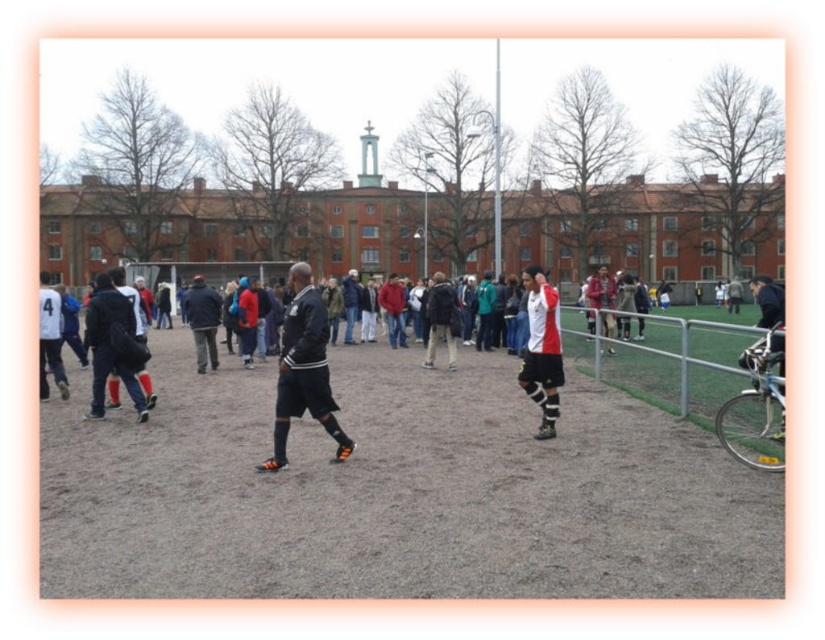
Between brown dirt field at center and white and red jersey at center, which one has more height?

white and red jersey at center is taller.

Identify the location of brown dirt field at center. This screenshot has width=825, height=640. (398, 492).

Between point (779, 477) and point (534, 336), which one is positioned in front?

Point (779, 477)

Locate an element on the screen. Image resolution: width=825 pixels, height=640 pixels. brown dirt field at center is located at coordinates (398, 492).

Is black leather jacket at center wider than white and red jersey at center?

Yes, black leather jacket at center is wider than white and red jersey at center.

Which is more to the right, black leather jacket at center or white and red jersey at center?

white and red jersey at center is more to the right.

Find the location of `black leather jacket at center`. black leather jacket at center is located at coordinates (304, 371).

Can you confirm if brown dirt field at center is shorter than black leather jacket at center?

Yes, brown dirt field at center is shorter than black leather jacket at center.

Looking at this image, can you confirm if brown dirt field at center is bigger than black leather jacket at center?

Yes.

Which is in front, point (45, 573) or point (300, 284)?

Point (45, 573)

Where is `brown dirt field at center`? The image size is (825, 640). brown dirt field at center is located at coordinates (398, 492).